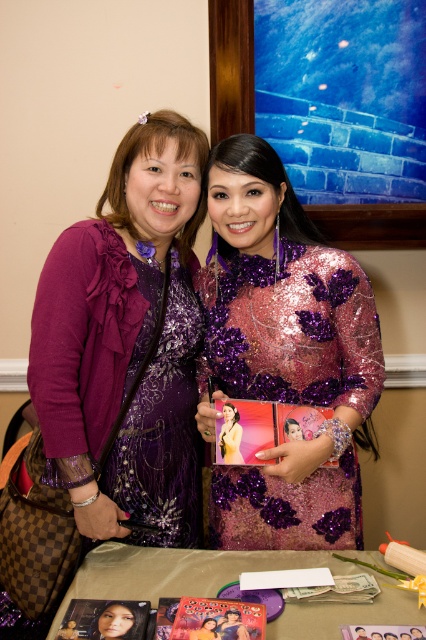
You are standing in the scene and want to move from the point at coordinates point (310, 472) to the point at coordinates point (362, 611). Which direction should you move to get closer to your destination?

To move from point (310, 472) to point (362, 611), you should move towards the right and upwards since point (362, 611) is located to the right and above point (310, 472).

You are a photographer setting up for a photoshoot. You need to place a small prop between the sequined purple dress at center and the metallic gold table at lower center. Based on their positions, which side of the table should you place the prop to keep it aligned with the existing setup?

The sequined purple dress at center is positioned on the right side of metallic gold table at lower center, so placing the prop to the right side of the metallic gold table at lower center would align with the existing setup.

Based on the photo, you are an interior designer planning to hang a new picture in this room. The current metallic gold photo frame at center is located at coordinates point 0.969, 0.512. If you want to place a new picture 0.1 units to the left of the existing frame, what coordinates should you aim for?

To place the new picture 0.1 units to the left of the metallic gold photo frame at center, subtract 0.1 from the x coordinate. The new coordinates would be (218, 556).